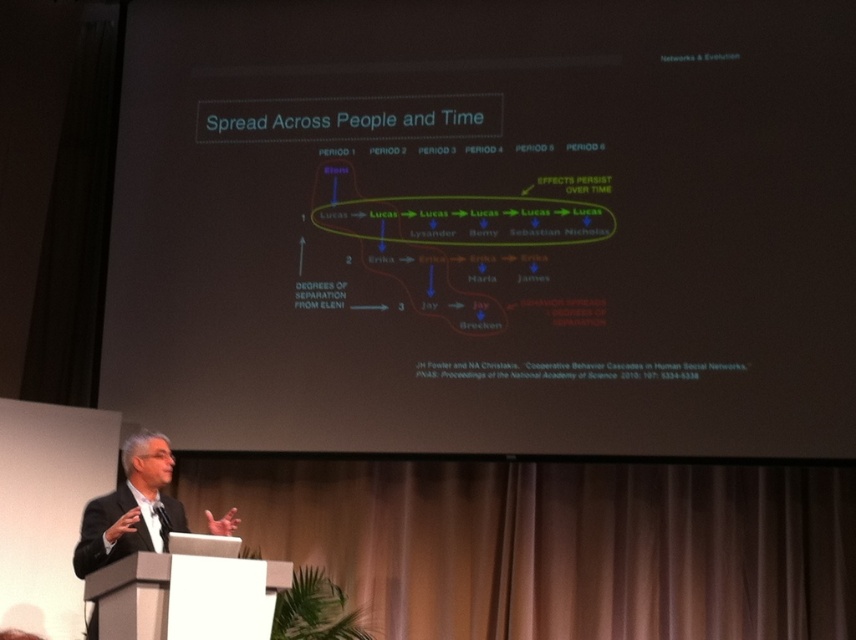
Question: Which object is closer to the camera taking this photo?

Choices:
 (A) black suit at lower left
 (B) black matte projection screen at upper center

Answer: (A)

Question: Which object is closer to the camera taking this photo?

Choices:
 (A) black matte projection screen at upper center
 (B) black suit at lower left

Answer: (B)

Question: Observing the image, what is the correct spatial positioning of black matte projection screen at upper center in reference to black suit at lower left?

Choices:
 (A) below
 (B) above

Answer: (B)

Question: Can you confirm if black matte projection screen at upper center is positioned below black suit at lower left?

Choices:
 (A) no
 (B) yes

Answer: (A)

Question: Can you confirm if black matte projection screen at upper center is positioned to the right of black suit at lower left?

Choices:
 (A) no
 (B) yes

Answer: (B)